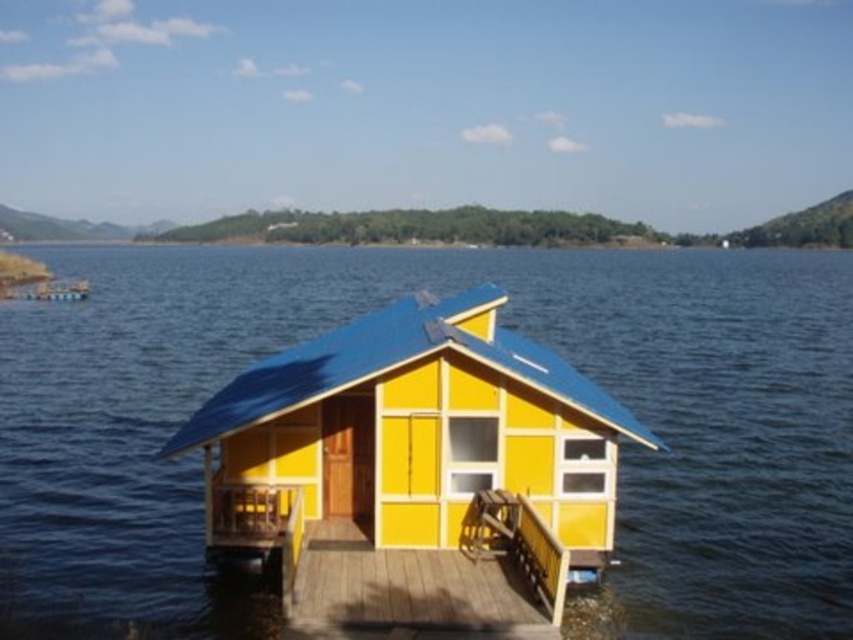
Question: Does blue water at center appear over yellow matte houseboat at center?

Choices:
 (A) no
 (B) yes

Answer: (B)

Question: Which point appears farthest from the camera in this image?

Choices:
 (A) pos(305,333)
 (B) pos(479,636)
 (C) pos(53,292)

Answer: (C)

Question: Is blue water at center positioned at the back of yellow painted wood hut at center?

Choices:
 (A) yes
 (B) no

Answer: (A)

Question: Can you confirm if blue water at center is positioned to the right of yellow matte houseboat at center?

Choices:
 (A) no
 (B) yes

Answer: (B)

Question: Estimate the real-world distances between objects in this image. Which object is closer to the blue water at center?

Choices:
 (A) yellow matte houseboat at center
 (B) yellow painted wood hut at center

Answer: (B)

Question: Which object is positioned closest to the yellow painted wood hut at center?

Choices:
 (A) wooden at center
 (B) yellow matte houseboat at center

Answer: (A)